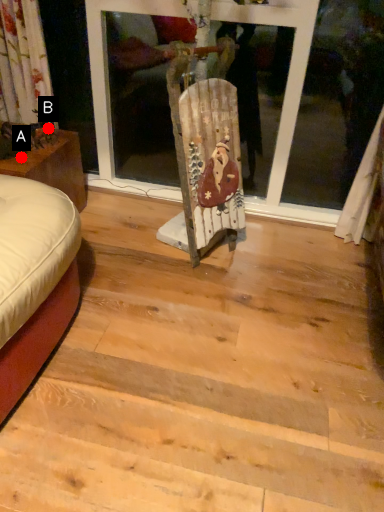
Question: Two points are circled on the image, labeled by A and B beside each circle. Among these points, which one is farthest from the camera?

Choices:
 (A) A is further
 (B) B is further

Answer: (B)